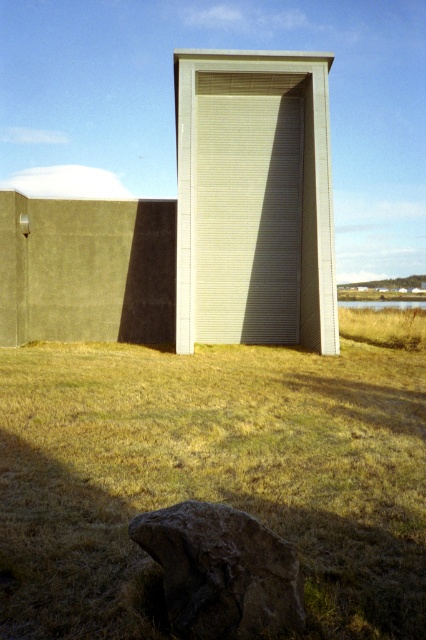
From the picture: Between dry grass at center and beige textured door at center, which one is positioned lower?

dry grass at center is below.

Can you confirm if dry grass at center is positioned to the right of beige textured door at center?

Incorrect, dry grass at center is not on the right side of beige textured door at center.

Where is `dry grass at center`? The image size is (426, 640). dry grass at center is located at coordinates (215, 474).

Who is positioned more to the right, beige textured door at center or dark brown rough rock at lower center?

beige textured door at center is more to the right.

Which is above, beige textured door at center or dark brown rough rock at lower center?

beige textured door at center is above.

Is point (233, 145) positioned before point (216, 609)?

No, it is not.

Locate an element on the screen. This screenshot has height=640, width=426. beige textured door at center is located at coordinates (253, 200).

Is dry grass at center to the left of dark brown rough rock at lower center from the viewer's perspective?

Indeed, dry grass at center is positioned on the left side of dark brown rough rock at lower center.

Who is more forward, (393, 550) or (138, 541)?

Positioned in front is point (138, 541).

Is point (46, 355) behind point (227, 588)?

Yes.

Where is `dry grass at center`? dry grass at center is located at coordinates (215, 474).